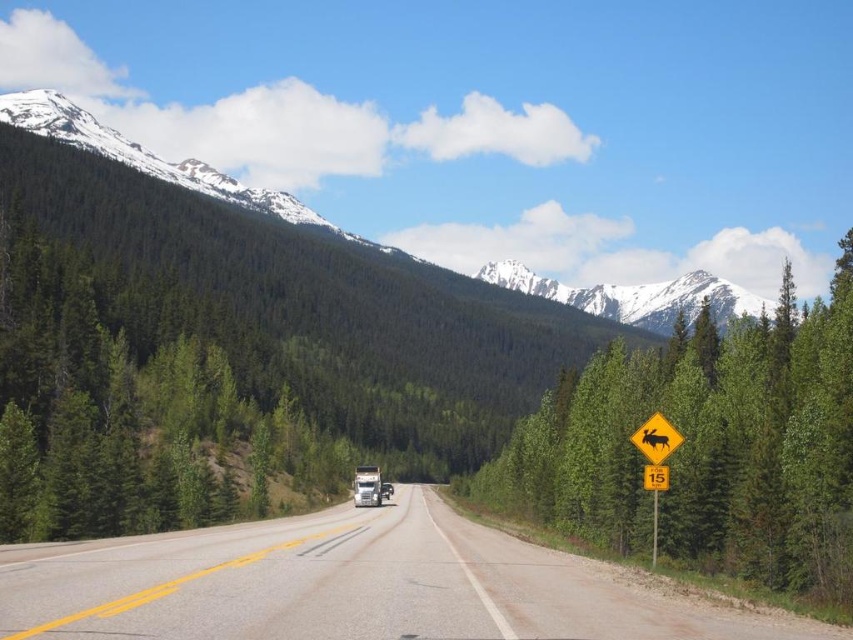
Question: Which object appears farthest from the camera in this image?

Choices:
 (A) snowy granite mountain at upper center
 (B) asphalt road at center

Answer: (A)

Question: From the image, what is the correct spatial relationship of snowy granite mountain at upper center in relation to brushed metal trailer truck at center?

Choices:
 (A) right
 (B) left

Answer: (A)

Question: Considering the relative positions of snowy granite mountain at upper center and yellow plastic sign at center right in the image provided, where is snowy granite mountain at upper center located with respect to yellow plastic sign at center right?

Choices:
 (A) above
 (B) below

Answer: (A)

Question: Can you confirm if snowy granite mountain at upper center is thinner than yellow plastic sign at center right?

Choices:
 (A) no
 (B) yes

Answer: (A)

Question: Which point is farther from the camera taking this photo?

Choices:
 (A) (125, 616)
 (B) (662, 484)

Answer: (B)

Question: Which of the following is the farthest from the observer?

Choices:
 (A) brushed metal trailer truck at center
 (B) snowy granite mountain at upper center

Answer: (A)